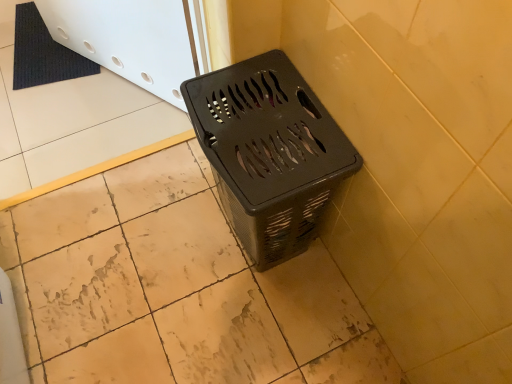
Describe the element at coordinates (269, 153) in the screenshot. I see `black plastic basket at center` at that location.

Where is `black plastic basket at center`? The width and height of the screenshot is (512, 384). black plastic basket at center is located at coordinates (269, 153).

In order to click on black plastic basket at center in this screenshot , I will do `click(269, 153)`.